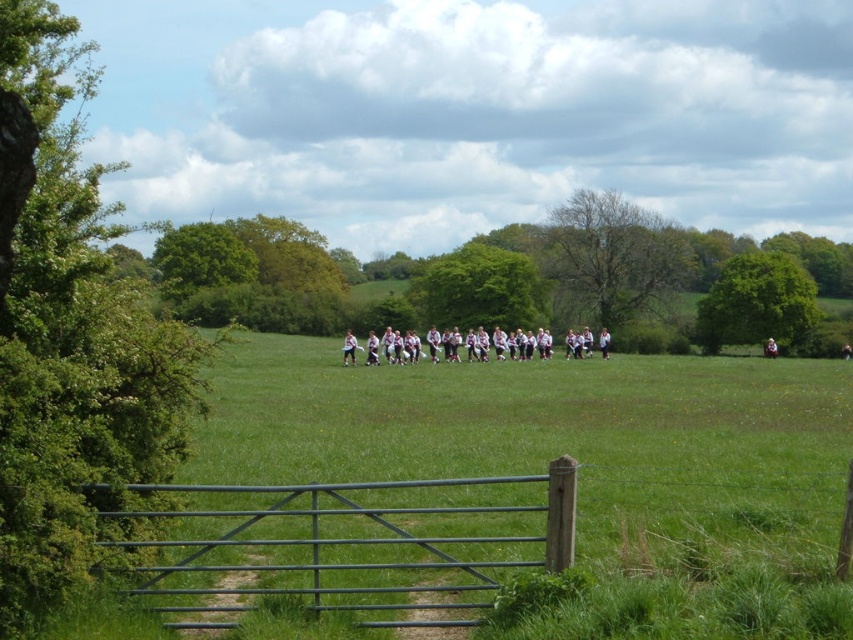
Question: Considering the relative positions of white fabric people at center and white fabric shirt at center in the image provided, where is white fabric people at center located with respect to white fabric shirt at center?

Choices:
 (A) above
 (B) below

Answer: (A)

Question: Which object appears farthest from the camera in this image?

Choices:
 (A) white cotton shirt at center
 (B) white fabric people at center

Answer: (A)

Question: Which is farther from the white cotton shirt at center?

Choices:
 (A) green painted metal gate at lower center
 (B) white fabric people at center

Answer: (A)

Question: Can you confirm if white fabric people at center is thinner than white fabric shirt at center?

Choices:
 (A) yes
 (B) no

Answer: (B)

Question: Does white fabric people at center have a lesser width compared to white cotton shirt at center?

Choices:
 (A) no
 (B) yes

Answer: (A)

Question: Which point appears farthest from the camera in this image?

Choices:
 (A) (572, 332)
 (B) (764, 348)
 (C) (558, 476)
 (D) (349, 352)

Answer: (B)